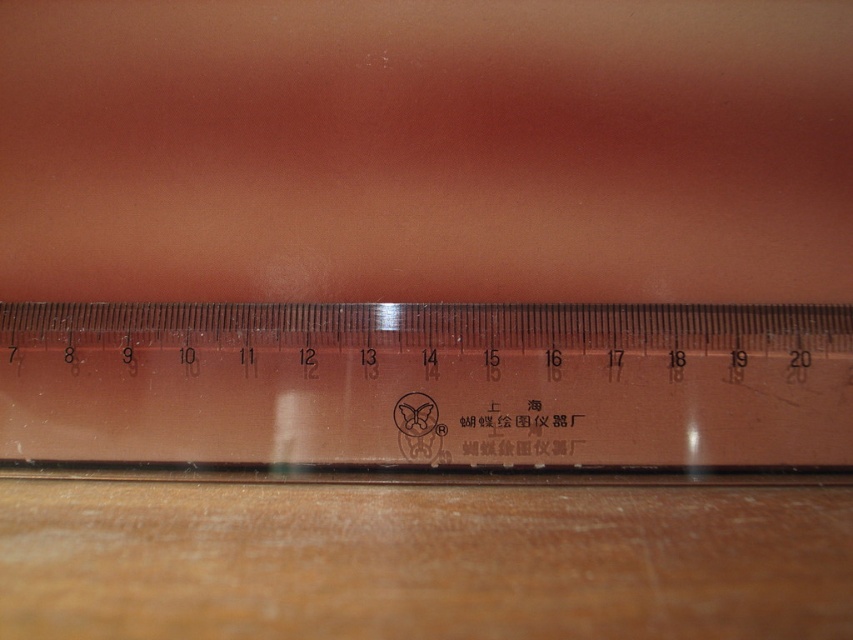
Question: Is transparent plastic ruler at center below wooden table at lower center?

Choices:
 (A) yes
 (B) no

Answer: (B)

Question: Does transparent plastic ruler at center have a greater width compared to wooden table at lower center?

Choices:
 (A) no
 (B) yes

Answer: (B)

Question: Is transparent plastic ruler at center positioned at the back of wooden table at lower center?

Choices:
 (A) yes
 (B) no

Answer: (A)

Question: Which object appears closest to the camera in this image?

Choices:
 (A) wooden table at lower center
 (B) transparent plastic ruler at center

Answer: (A)

Question: Which of the following is the farthest from the observer?

Choices:
 (A) transparent plastic ruler at center
 (B) wooden table at lower center

Answer: (A)